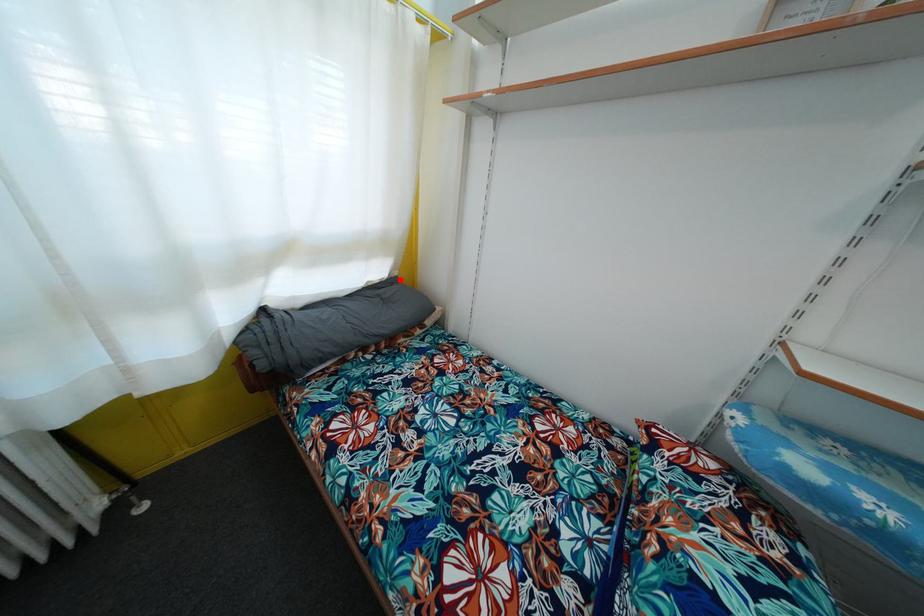
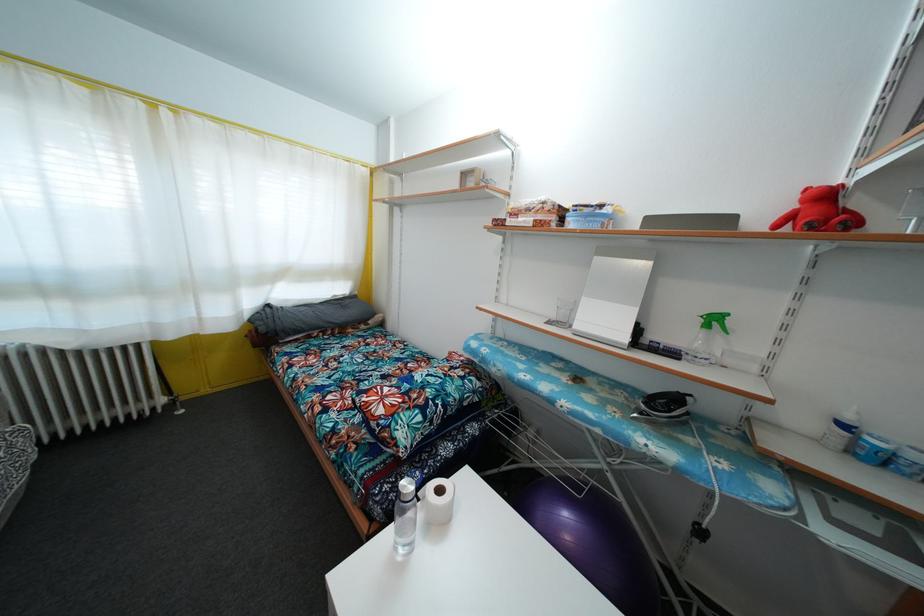
Where in the second image is the point corresponding to the highlighted location from the first image?

(359, 300)